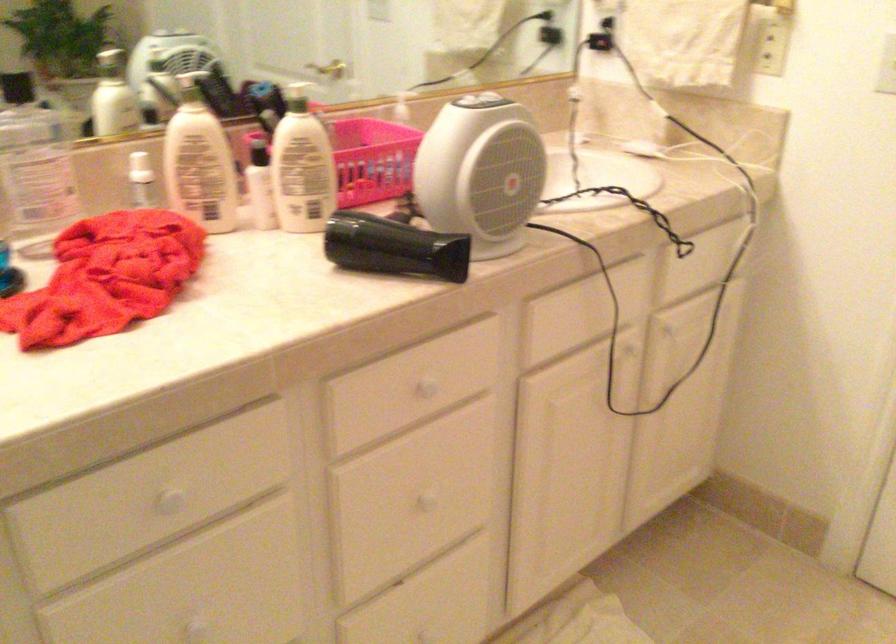
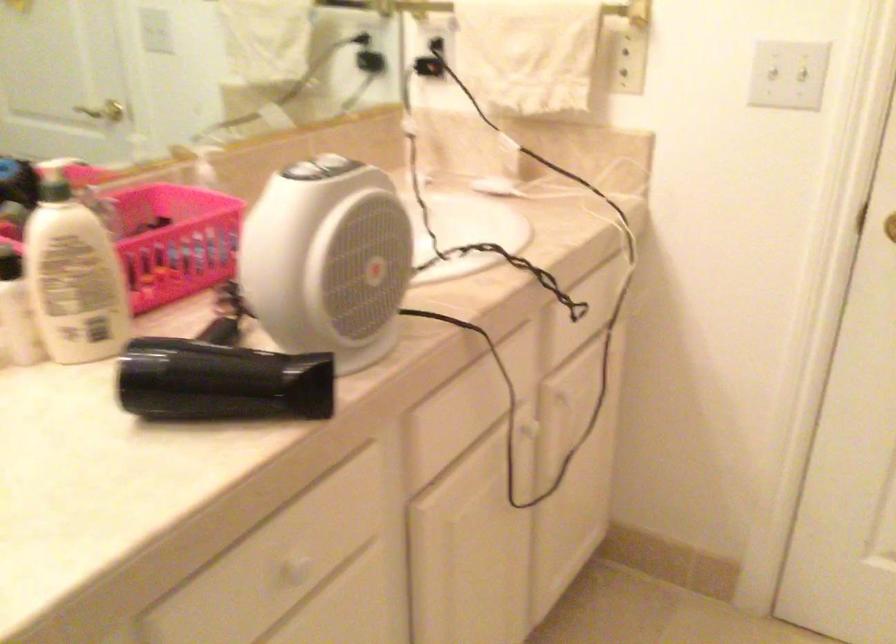
Question: Based on the continuous images, in which direction is the camera rotating? Reply with the corresponding letter.

Choices:
 (A) Left
 (B) Right
 (C) Up
 (D) Down

Answer: (B)